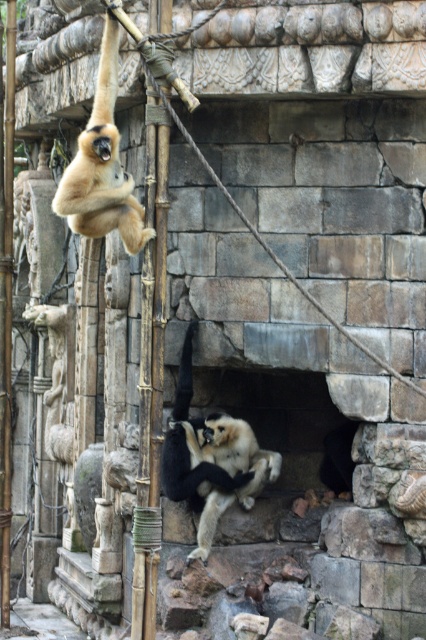
You are a zookeeper observing the gibbons in the enclosure. You notice two light beige fur at center and light beige fur at upper left. Which gibbon is shorter in height?

The light beige fur at center is shorter in height compared to the light beige fur at upper left.

You are standing at the entrance of the zoo enclosure and want to observe both points mentioned. Which point, point (154, 138) or point (187, 324), is closer to you?

Point (154, 138) is in front of point (187, 324), so it is closer to you.